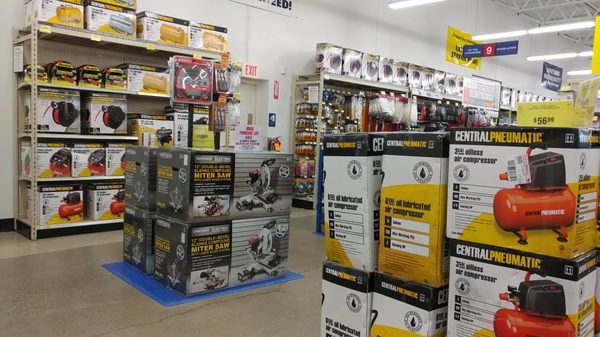
Identify the location of door, emergency exit. (250, 103).